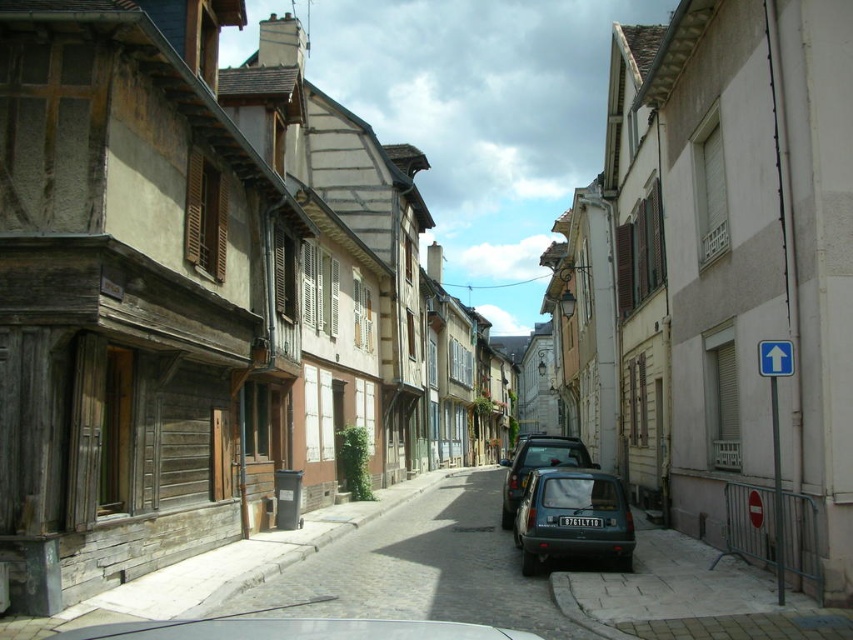
You are a delivery driver with a large van that needs to park on the narrow cobblestone street. You see a matte dark green car at center and a matte black car at center. Which car should you ask to move so that your van can fit in the parking spot?

You should ask the matte black car at center to move because it occupies more space than the matte dark green car at center, so removing it would free up enough space for the van.

You are a delivery person trying to park a new compact car that is 1.5 meters tall. You see the matte black car at center and the black plastic license plate at center in the parking spot. Can your car fit in the parking spot without hitting the overhead structure?

The matte black car at center has a greater height compared to the black plastic license plate at center. However, the description does not provide specific measurements for the overhead clearance. Therefore, it is uncertain if your car can fit without hitting anything.